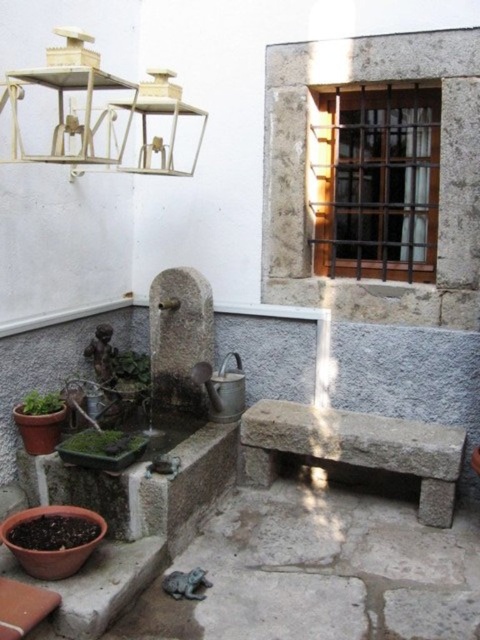
Question: Can you confirm if green leafy plant at lower center is positioned to the right of green matte planter at lower left?

Choices:
 (A) yes
 (B) no

Answer: (A)

Question: Which point is farther to the camera?

Choices:
 (A) green matte planter at lower left
 (B) green leafy plant at lower left
 (C) green leafy plant at lower center

Answer: (B)

Question: Can you confirm if green leafy plant at lower center is wider than green leafy plant at lower left?

Choices:
 (A) no
 (B) yes

Answer: (B)

Question: Which of the following is the closest to the observer?

Choices:
 (A) click(x=108, y=435)
 (B) click(x=129, y=358)
 (C) click(x=57, y=403)

Answer: (A)

Question: Is green leafy plant at lower left closer to camera compared to green matte planter at lower left?

Choices:
 (A) no
 (B) yes

Answer: (A)

Question: Which point is closer to the camera?

Choices:
 (A) green leafy plant at lower left
 (B) green matte planter at lower left

Answer: (B)